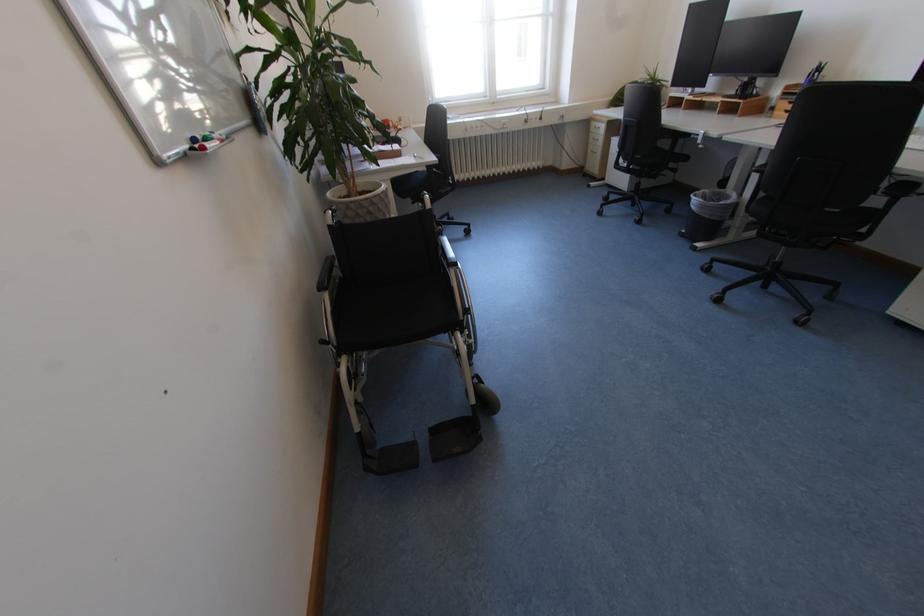
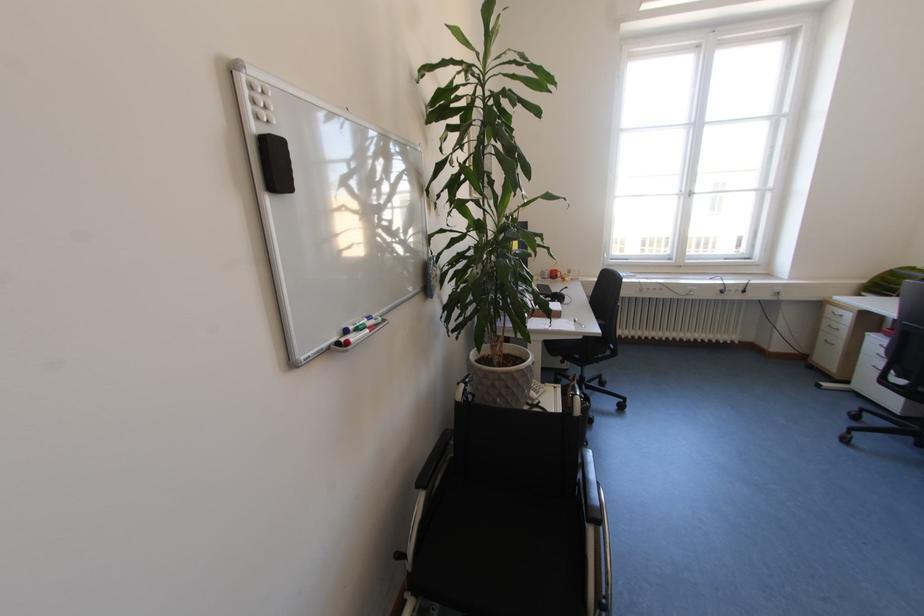
Where in the second image is the point corresponding to (x=213, y=140) from the first image?

(366, 330)